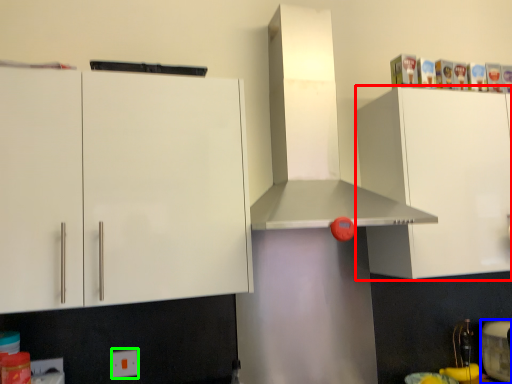
Question: Considering the real-world distances, which object is closest to cabinetry (highlighted by a red box)? appliance (highlighted by a blue box) or electric outlet (highlighted by a green box).

Choices:
 (A) appliance
 (B) electric outlet

Answer: (A)